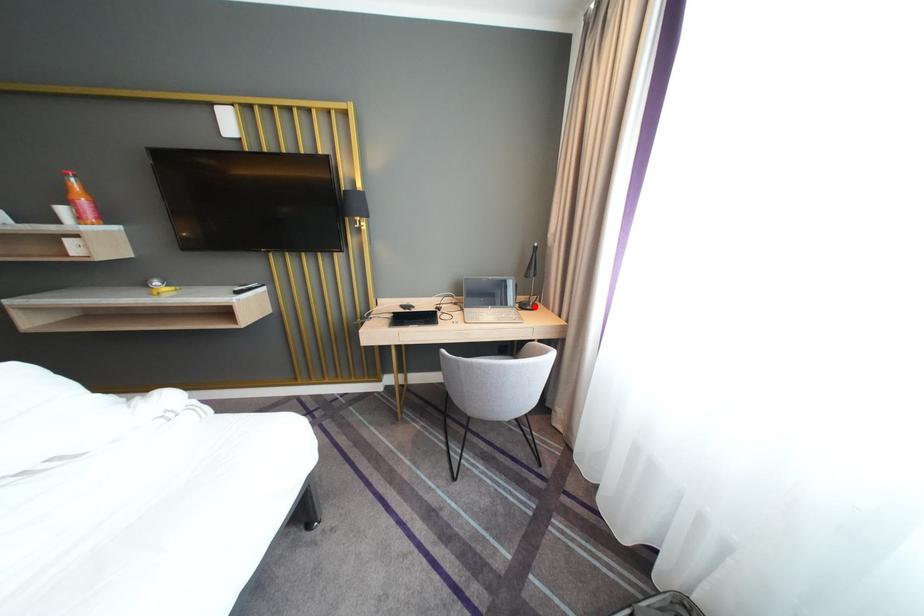
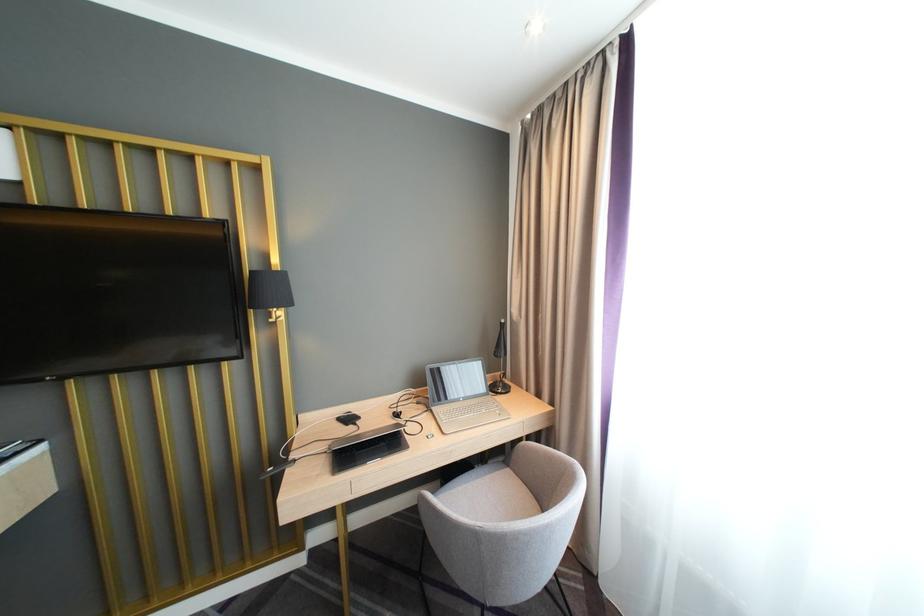
Question: I am providing you with two images of the same scene from different viewpoints. A red point is marked on the first image. At the location where the point appears in image 1, is it still visible in image 2?

Choices:
 (A) Yes
 (B) No

Answer: (A)